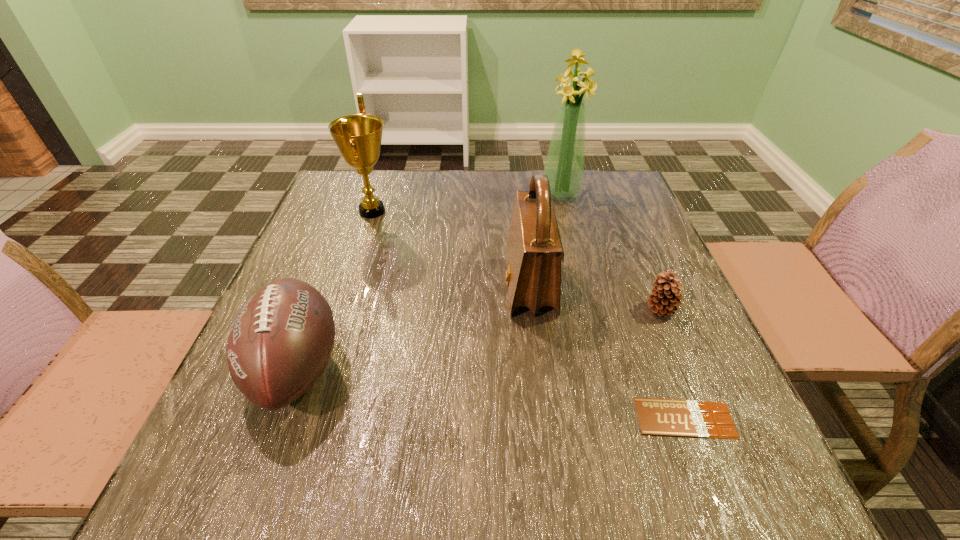
Identify the location of free space that is in between the pinecone and the chocolate bar. This screenshot has width=960, height=540. (673, 363).

Locate an element on the screen. vacant area that lies between the bouquet and the fourth tallest object is located at coordinates (429, 282).

The image size is (960, 540). In order to click on free space between the shoulder bag and the award in this screenshot , I will do `click(451, 248)`.

Where is `vacant point located between the fourth object from right to left and the pinecone`? This screenshot has width=960, height=540. vacant point located between the fourth object from right to left and the pinecone is located at coordinates (595, 298).

Where is `empty location between the shoulder bag and the shortest object`? The width and height of the screenshot is (960, 540). empty location between the shoulder bag and the shortest object is located at coordinates (607, 352).

Select which object appears as the third closest to the shoulder bag. Please provide its 2D coordinates. Your answer should be formatted as a tuple, i.e. [(x, y)], where the tuple contains the x and y coordinates of a point satisfying the conditions above.

[(564, 166)]

Select which object is the fifth closest to the pinecone. Please provide its 2D coordinates. Your answer should be formatted as a tuple, i.e. [(x, y)], where the tuple contains the x and y coordinates of a point satisfying the conditions above.

[(358, 137)]

Locate an element on the screen. This screenshot has height=540, width=960. free location that satisfies the following two spatial constraints: 1. on the back side of the shortest object; 2. on the front view with handles of the award is located at coordinates (606, 211).

Find the location of a particular element. This screenshot has width=960, height=540. free space in the image that satisfies the following two spatial constraints: 1. on the front view with handles of the fifth tallest object; 2. on the right side of the award is located at coordinates (341, 309).

This screenshot has height=540, width=960. I want to click on free space that satisfies the following two spatial constraints: 1. on the front flap of the shoulder bag; 2. on the left side of the pinecone, so click(x=533, y=309).